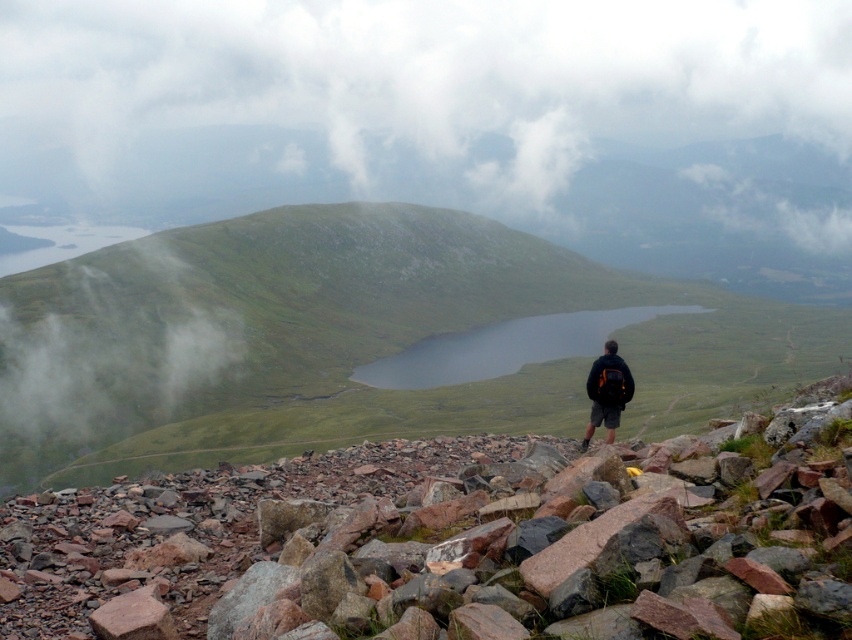
Does point (268, 44) come closer to viewer compared to point (594, 397)?

No, it is behind (594, 397).

Looking at this image, is white fluffy cloud at upper center positioned before dark blue jacket at center?

No.

Between point (807, 12) and point (619, 360), which one is positioned in front?

Point (619, 360) is in front.

You are a GUI agent. You are given a task and a screenshot of the screen. Output one action in this format:
    pyautogui.click(x=<x>, y=<y>)
    Task: Click on the white fluffy cloud at upper center
    This screenshot has width=852, height=640.
    Given the screenshot: What is the action you would take?
    pyautogui.click(x=394, y=97)

Can you confirm if white fluffy cloud at upper center is positioned to the left of rusty rock pile at center?

Indeed, white fluffy cloud at upper center is positioned on the left side of rusty rock pile at center.

Between white fluffy cloud at upper center and rusty rock pile at center, which one is positioned higher?

white fluffy cloud at upper center is above.

Is point (350, 19) closer to camera compared to point (170, 572)?

No, it is not.

The image size is (852, 640). Identify the location of white fluffy cloud at upper center. (394, 97).

Can you confirm if rusty rock pile at center is positioned to the right of dark blue jacket at center?

No, rusty rock pile at center is not to the right of dark blue jacket at center.

Does point (413, 600) come in front of point (596, 410)?

Yes, point (413, 600) is closer to viewer.

The height and width of the screenshot is (640, 852). I want to click on rusty rock pile at center, so click(429, 540).